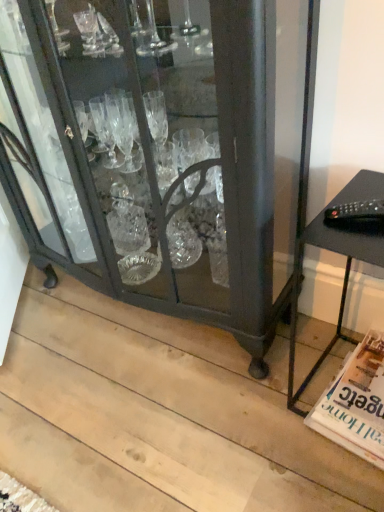
At what (x,y) coordinates should I click in order to perform the action: click on free space between white glossy magazine at lower right and matte black cabinet at center. Please return your answer as a coordinate pair (x, y). This screenshot has height=512, width=384. Looking at the image, I should click on (270, 370).